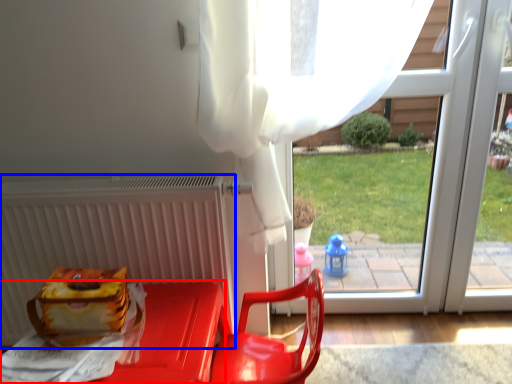
Question: Among these objects, which one is nearest to the camera, furniture (highlighted by a red box) or radiator (highlighted by a blue box)?

Choices:
 (A) furniture
 (B) radiator

Answer: (A)